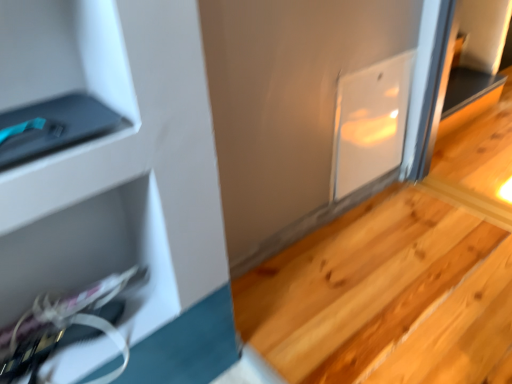
Question: Could you tell me if white glossy scissors at lower left is turned towards natural wood stairs at lower right?

Choices:
 (A) yes
 (B) no

Answer: (B)

Question: Is white glossy scissors at lower left further to camera compared to natural wood stairs at lower right?

Choices:
 (A) no
 (B) yes

Answer: (A)

Question: Is white glossy scissors at lower left to the left of natural wood stairs at lower right from the viewer's perspective?

Choices:
 (A) no
 (B) yes

Answer: (B)

Question: Does white glossy scissors at lower left have a greater height compared to natural wood stairs at lower right?

Choices:
 (A) no
 (B) yes

Answer: (A)

Question: Does white glossy scissors at lower left have a lesser width compared to natural wood stairs at lower right?

Choices:
 (A) no
 (B) yes

Answer: (B)

Question: Does white glossy scissors at lower left have a smaller size compared to natural wood stairs at lower right?

Choices:
 (A) yes
 (B) no

Answer: (A)

Question: Can you confirm if natural wood stairs at lower right is thinner than white glossy scissors at lower left?

Choices:
 (A) no
 (B) yes

Answer: (A)

Question: Is natural wood stairs at lower right facing away from white glossy scissors at lower left?

Choices:
 (A) yes
 (B) no

Answer: (B)

Question: Is natural wood stairs at lower right not inside white glossy scissors at lower left?

Choices:
 (A) no
 (B) yes

Answer: (B)

Question: Can you confirm if natural wood stairs at lower right is taller than white glossy scissors at lower left?

Choices:
 (A) no
 (B) yes

Answer: (B)

Question: From the image's perspective, does natural wood stairs at lower right appear higher than white glossy scissors at lower left?

Choices:
 (A) no
 (B) yes

Answer: (A)

Question: Is the depth of natural wood stairs at lower right less than that of white glossy scissors at lower left?

Choices:
 (A) no
 (B) yes

Answer: (A)

Question: In the image, is white glossy scissors at lower left positioned in front of or behind natural wood stairs at lower right?

Choices:
 (A) behind
 (B) front

Answer: (B)